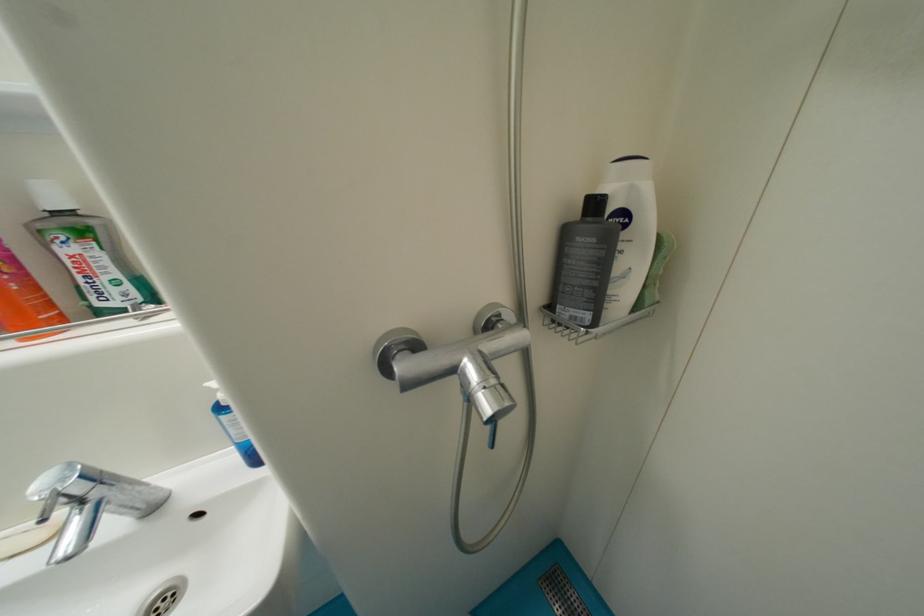
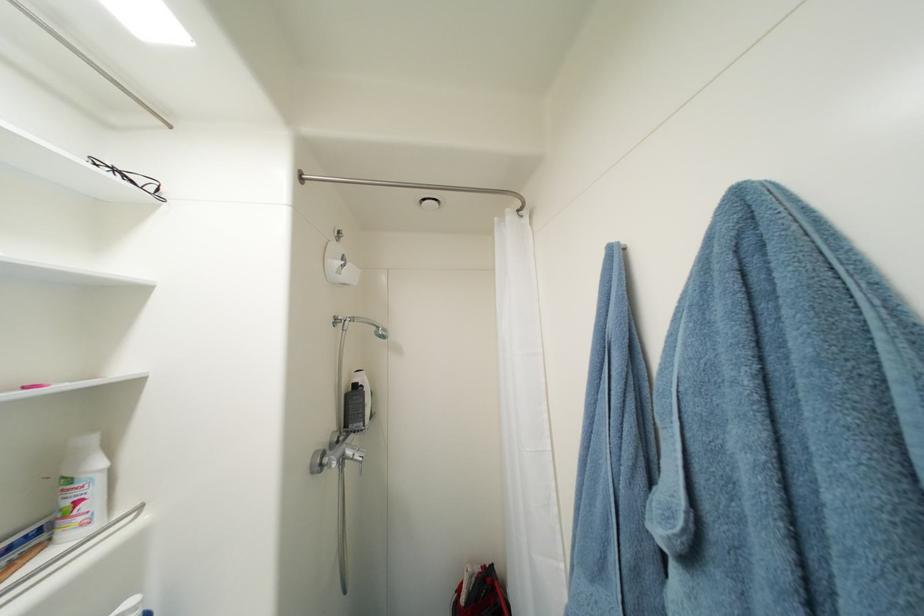
Find the pixel in the second image that matches (x=601, y=206) in the first image.

(361, 387)